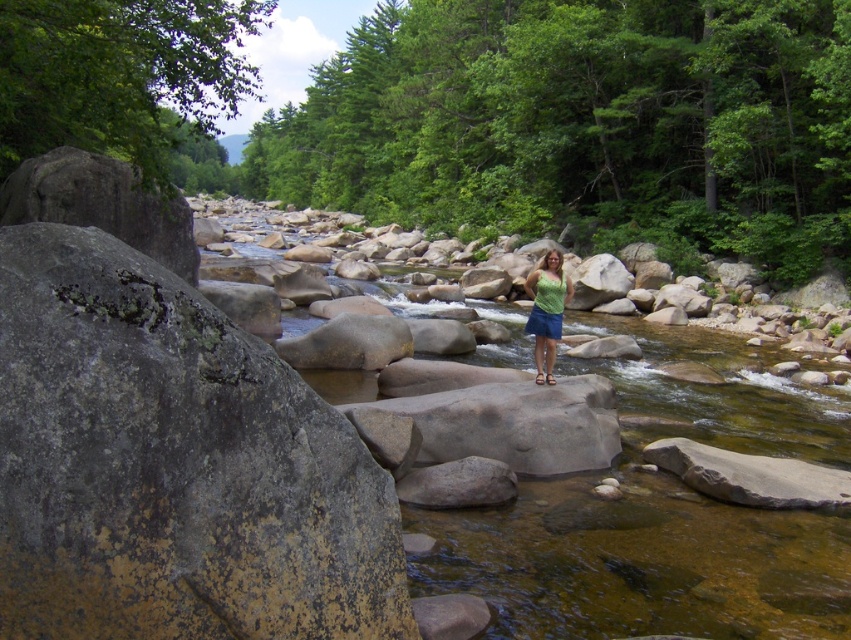
Is point (9, 531) closer to viewer compared to point (527, 285)?

Yes, it is in front of point (527, 285).

Does grayish-brown textured rock at left lie behind green matte tank top at center?

No, it is in front of green matte tank top at center.

Is point (210, 422) behind point (553, 356)?

No.

Where is `grayish-brown textured rock at left`? This screenshot has height=640, width=851. grayish-brown textured rock at left is located at coordinates (172, 465).

Can you confirm if grayish-brown textured rock at left is positioned below blue denim shorts at center?

Yes.

Who is higher up, grayish-brown textured rock at left or blue denim shorts at center?

blue denim shorts at center is above.

Which is in front, point (330, 624) or point (557, 330)?

Point (330, 624) is in front.

Where is `grayish-brown textured rock at left`? The height and width of the screenshot is (640, 851). grayish-brown textured rock at left is located at coordinates (172, 465).

Does point (534, 358) come closer to viewer compared to point (550, 333)?

That is False.

Is point (547, 282) farther from viewer compared to point (557, 323)?

Yes, it is.

Find the location of `green matte tank top at center`. green matte tank top at center is located at coordinates (x=546, y=310).